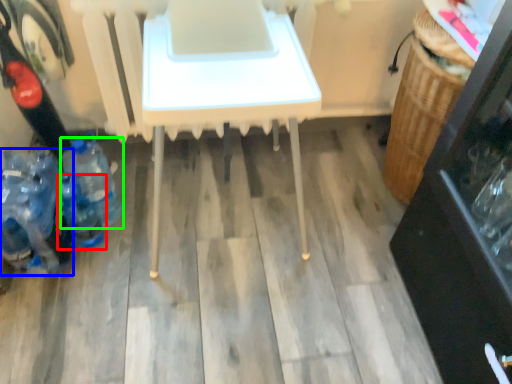
Question: Which is nearer to the bottle (highlighted by a red box)? bottle (highlighted by a blue box) or bottle (highlighted by a green box).

Choices:
 (A) bottle
 (B) bottle

Answer: (A)